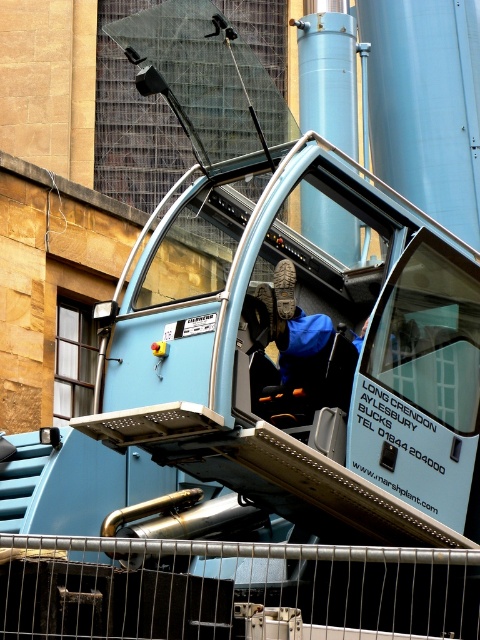
Which of these two, metal at lower center or blue fabric jacket at center, stands shorter?

metal at lower center is shorter.

From the picture: Between metal at lower center and blue fabric jacket at center, which one appears on the left side from the viewer's perspective?

From the viewer's perspective, metal at lower center appears more on the left side.

Is point (211, 588) more distant than point (310, 403)?

No.

Locate an element on the screen. metal at lower center is located at coordinates (232, 589).